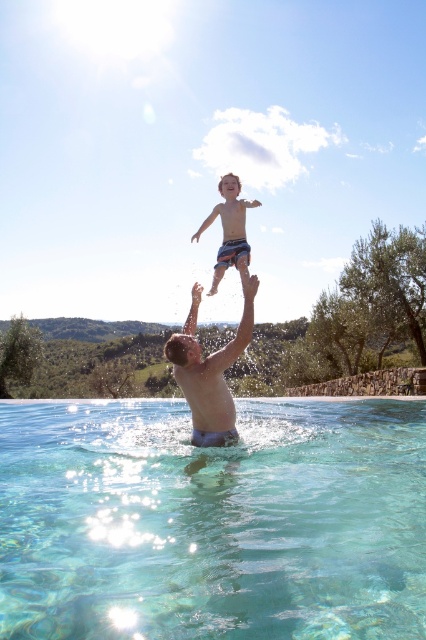
You are a safety inspector checking the pool area. The safety guidelines state that the distance between any two people in the pool must be at least 1.5 meters for safety. Based on the image, is the distance between the clear glass water at lower center and the smooth skin man at center compliant with the safety guidelines?

The distance between the clear glass water at lower center and the smooth skin man at center is 1.26 meters, which is less than the required 1.5 meters. Therefore, it does not comply with the safety guidelines.

Based on the photo, you are a drone operator trying to capture the perfect aerial shot of the scene. You have two points marked on your map, point A at coordinates point (x=250, y=300) and point B at coordinates point (x=245, y=275). From the perspective of the camera, which point is closer to the front of the scene?

Point point (x=250, y=300) is in front of point point (x=245, y=275), so from the camera perspective, point A is closer to the front of the scene.

You are standing at the edge of the pool and want to jump into the water. There are two points marked in the pool where you can land. The first point is at coordinate point(106, 492) and the second point is at coordinate point(195, 397). Which point is closer to you?

Point(106, 492) is closer to the viewer than point(195, 397), so you should choose point(106, 492) as it is nearer to your current position at the edge.